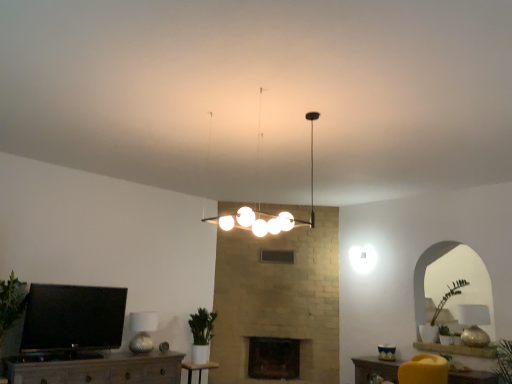
Question: From the image's perspective, is green matte plant at center located beneath white glossy light fixture at center, the third lamp in the back-to-front sequence?

Choices:
 (A) yes
 (B) no

Answer: (A)

Question: Does green matte plant at center turn towards white glossy light fixture at center, marked as the 2th lamp in a left-to-right arrangement?

Choices:
 (A) yes
 (B) no

Answer: (B)

Question: Is green matte plant at center bigger than white glossy light fixture at center, which is the third lamp in bottom-to-top order?

Choices:
 (A) no
 (B) yes

Answer: (A)

Question: Would you say green matte plant at center contains white glossy light fixture at center, marked as the 2th lamp in a left-to-right arrangement?

Choices:
 (A) yes
 (B) no

Answer: (B)

Question: Does green matte plant at center lie in front of white glossy light fixture at center, the 1th lamp from the top?

Choices:
 (A) yes
 (B) no

Answer: (B)

Question: Considering the positions of point (371, 360) and point (195, 326), is point (371, 360) closer or farther from the camera than point (195, 326)?

Choices:
 (A) closer
 (B) farther

Answer: (B)

Question: Looking at their shapes, would you say velvet yellow armchair at lower right, which is the second furniture from left to right, is wider or thinner than green matte plant at center?

Choices:
 (A) wide
 (B) thin

Answer: (A)

Question: Is velvet yellow armchair at lower right, which is the second furniture from left to right, inside the boundaries of green matte plant at center, or outside?

Choices:
 (A) inside
 (B) outside

Answer: (B)

Question: From the image's perspective, is velvet yellow armchair at lower right, which is the second furniture from left to right, above or below green matte plant at center?

Choices:
 (A) below
 (B) above

Answer: (A)

Question: Visually, is wooden table at center, the first table from the left, positioned to the left or to the right of metallic textured lampshade at lower left, the third lamp when ordered from right to left?

Choices:
 (A) left
 (B) right

Answer: (B)

Question: From a real-world perspective, relative to metallic textured lampshade at lower left, which is the 1th lamp in bottom-to-top order, is wooden table at center, the first table from the left, vertically above or below?

Choices:
 (A) below
 (B) above

Answer: (A)

Question: Considering their positions, is wooden table at center, which is the second table in top-to-bottom order, located in front of or behind metallic textured lampshade at lower left, arranged as the third lamp when viewed from the front?

Choices:
 (A) behind
 (B) front

Answer: (A)

Question: Considering the positions of wooden table at center, which is the second table in top-to-bottom order, and metallic textured lampshade at lower left, the third lamp when ordered from right to left, in the image, is wooden table at center, which is the second table in top-to-bottom order, taller or shorter than metallic textured lampshade at lower left, the third lamp when ordered from right to left,?

Choices:
 (A) tall
 (B) short

Answer: (B)

Question: Considering the positions of point (77, 357) and point (362, 380), is point (77, 357) closer or farther from the camera than point (362, 380)?

Choices:
 (A) farther
 (B) closer

Answer: (B)

Question: From the image's perspective, is matte wood tv stand at lower left, the 2th furniture viewed from the right, located above or below matte wood table at lower center, arranged as the 1th table when viewed from the right?

Choices:
 (A) below
 (B) above

Answer: (A)